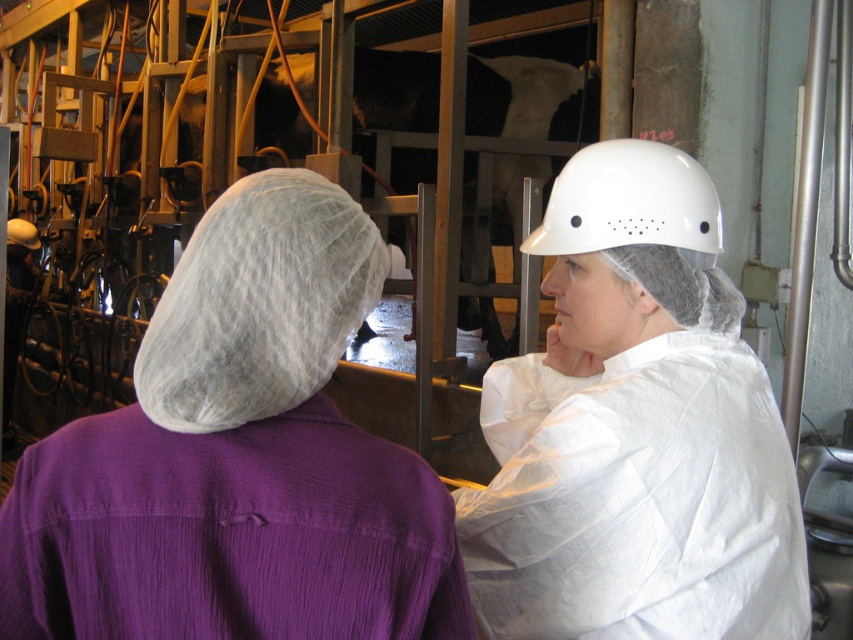
Question: Which object is positioned closest to the white matte hard hat at upper right?

Choices:
 (A) purple fabric shirt at upper left
 (B) white hard hat at center
 (C) white matte helmet at upper center

Answer: (B)

Question: Which point is closer to the camera taking this photo?

Choices:
 (A) (717, 225)
 (B) (183, 420)

Answer: (B)

Question: In this image, where is purple fabric shirt at upper left located relative to white matte hard hat at upper right?

Choices:
 (A) left
 (B) right

Answer: (A)

Question: Can you confirm if purple fabric shirt at upper left is positioned to the right of white hard hat at center?

Choices:
 (A) no
 (B) yes

Answer: (A)

Question: Which point is farther from the camera taking this photo?

Choices:
 (A) (271, 516)
 (B) (625, 364)
 (C) (338, 284)

Answer: (B)

Question: Does white matte helmet at upper center have a greater width compared to white hard hat at center?

Choices:
 (A) no
 (B) yes

Answer: (A)